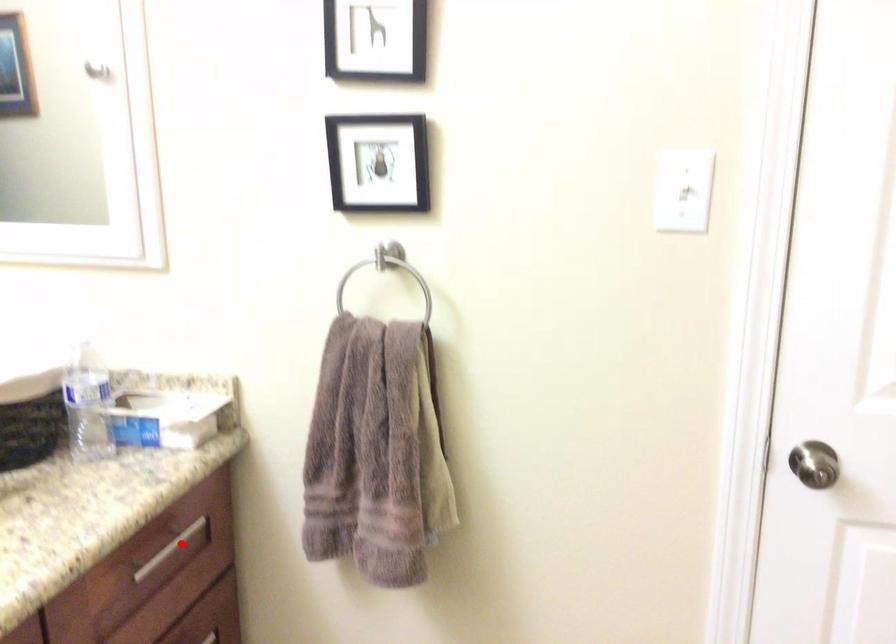
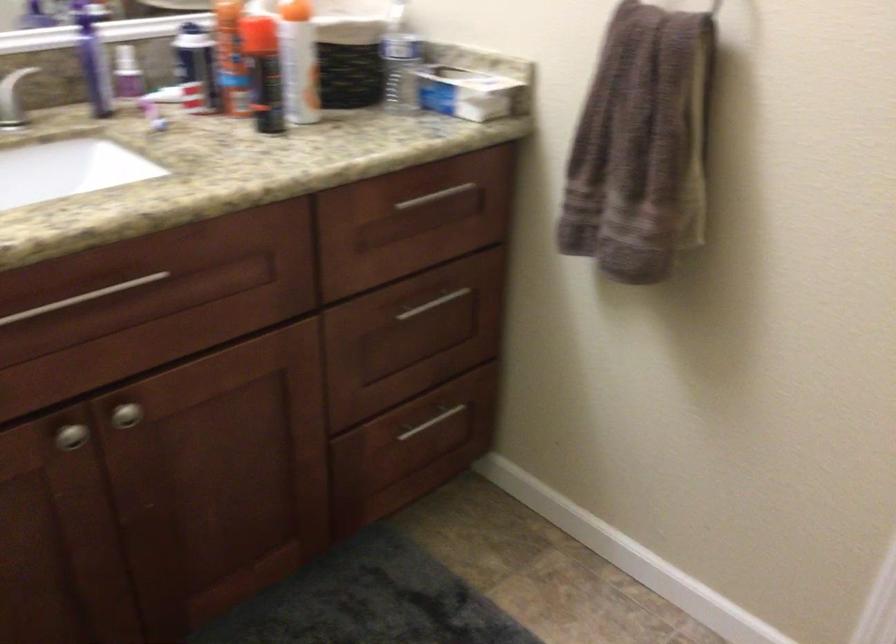
In the second image, find the point that corresponds to the highlighted location in the first image.

(445, 201)